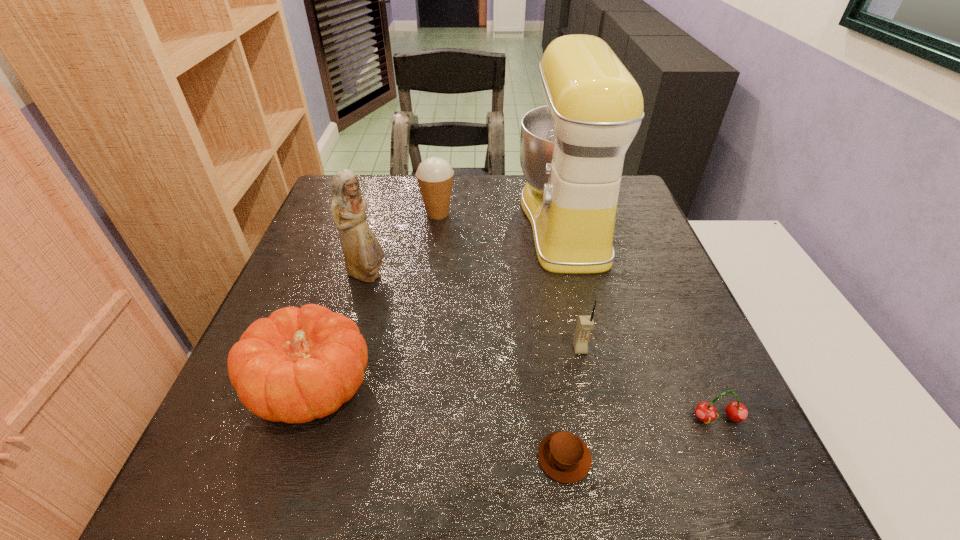
Locate an element on the screen. mixer is located at coordinates (572, 151).

Locate an element on the screen. Image resolution: width=960 pixels, height=540 pixels. figurine is located at coordinates (363, 254).

The image size is (960, 540). I want to click on icecream, so click(434, 175).

Where is `pumpkin`? pumpkin is located at coordinates (297, 365).

In order to click on cellular telephone in this screenshot , I will do `click(585, 324)`.

In order to click on the second shortest object in this screenshot , I will do `click(736, 411)`.

I want to click on the rightmost object, so click(736, 411).

In order to click on muffin in this screenshot , I will do `click(563, 456)`.

At what (x,y) coordinates should I click in order to perform the action: click on free space located 0.190m on the side of the mixer with the control knob. Please return your answer as a coordinate pair (x, y). Looking at the image, I should click on (448, 222).

What are the coordinates of `free region located 0.060m on the side of the mixer with the control knob` in the screenshot? It's located at (496, 222).